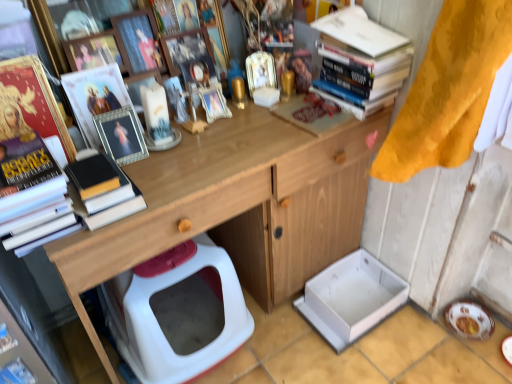
Find the location of a particular element. The width and height of the screenshot is (512, 384). spots to the right of metallic silver photo frame at upper center is located at coordinates (187, 146).